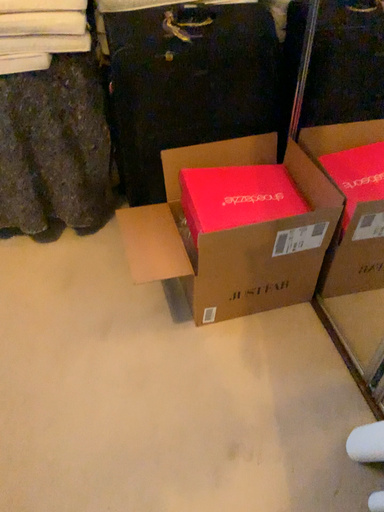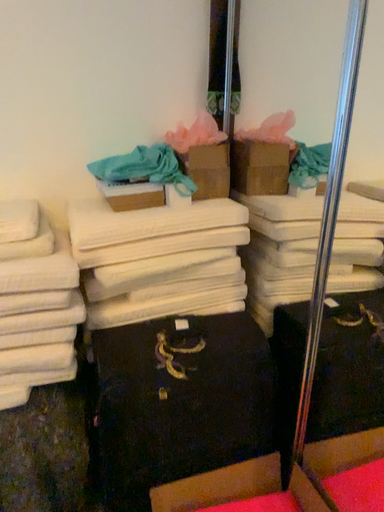
Question: How did the camera likely rotate when shooting the video?

Choices:
 (A) rotated upward
 (B) rotated downward

Answer: (A)